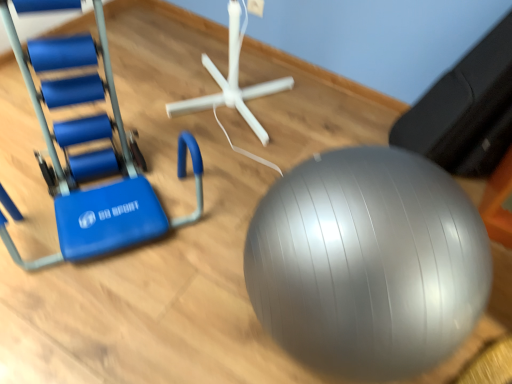
Describe the element at coordinates (102, 186) in the screenshot. The image size is (512, 384). I see `blue rubber swivel chair at left` at that location.

Measure the distance between blue rubber swivel chair at left and camera.

blue rubber swivel chair at left and camera are 3.43 feet apart from each other.

Identify the location of blue rubber swivel chair at left. (102, 186).

Where is `silver rubber ball at center`? silver rubber ball at center is located at coordinates (368, 263).

The height and width of the screenshot is (384, 512). Describe the element at coordinates (368, 263) in the screenshot. I see `silver rubber ball at center` at that location.

The image size is (512, 384). Find the location of `blue rubber swivel chair at left`. blue rubber swivel chair at left is located at coordinates (102, 186).

Which object is positioned more to the right, silver rubber ball at center or blue rubber swivel chair at left?

From the viewer's perspective, silver rubber ball at center appears more on the right side.

Relative to blue rubber swivel chair at left, is silver rubber ball at center in front or behind?

silver rubber ball at center is positioned closer to the viewer than blue rubber swivel chair at left.

Is point (300, 291) more distant than point (91, 226)?

No, it is not.

From the image's perspective, relative to blue rubber swivel chair at left, is silver rubber ball at center above or below?

From the image's perspective, silver rubber ball at center appears below blue rubber swivel chair at left.

From a real-world perspective, is silver rubber ball at center physically located above or below blue rubber swivel chair at left?

silver rubber ball at center is situated lower than blue rubber swivel chair at left in the real world.

Considering the sizes of objects silver rubber ball at center and blue rubber swivel chair at left in the image provided, who is thinner, silver rubber ball at center or blue rubber swivel chair at left?

With smaller width is blue rubber swivel chair at left.

From the picture: Can you confirm if silver rubber ball at center is shorter than blue rubber swivel chair at left?

Yes, silver rubber ball at center is shorter than blue rubber swivel chair at left.

Which of these two, silver rubber ball at center or blue rubber swivel chair at left, is bigger?

Bigger between the two is blue rubber swivel chair at left.

Is silver rubber ball at center situated inside blue rubber swivel chair at left or outside?

silver rubber ball at center lies outside blue rubber swivel chair at left.

Are silver rubber ball at center and blue rubber swivel chair at left beside each other?

No, silver rubber ball at center is not in contact with blue rubber swivel chair at left.

Is silver rubber ball at center facing towards blue rubber swivel chair at left?

No.

Can you tell me how much silver rubber ball at center and blue rubber swivel chair at left differ in facing direction?

silver rubber ball at center and blue rubber swivel chair at left are facing 85.7 degrees away from each other.

Measure the distance between silver rubber ball at center and blue rubber swivel chair at left.

silver rubber ball at center and blue rubber swivel chair at left are 26.09 inches apart from each other.

The image size is (512, 384). I want to click on ball located in front of the blue rubber swivel chair at left, so click(368, 263).

Would you say blue rubber swivel chair at left is to the left or to the right of silver rubber ball at center in the picture?

Based on their positions, blue rubber swivel chair at left is located to the left of silver rubber ball at center.

In the image, is blue rubber swivel chair at left positioned in front of or behind silver rubber ball at center?

Clearly, blue rubber swivel chair at left is behind silver rubber ball at center.

Considering the positions of point (48, 178) and point (455, 208), is point (48, 178) closer or farther from the camera than point (455, 208)?

Point (48, 178) is farther from the camera than point (455, 208).

From the image's perspective, is blue rubber swivel chair at left on silver rubber ball at center?

Indeed, from the image's perspective, blue rubber swivel chair at left is shown above silver rubber ball at center.

From a real-world perspective, is blue rubber swivel chair at left positioned under silver rubber ball at center based on gravity?

No, from a real-world perspective, blue rubber swivel chair at left is not beneath silver rubber ball at center.

Considering the relative sizes of blue rubber swivel chair at left and silver rubber ball at center in the image provided, is blue rubber swivel chair at left wider than silver rubber ball at center?

In fact, blue rubber swivel chair at left might be narrower than silver rubber ball at center.

Which of these two, blue rubber swivel chair at left or silver rubber ball at center, stands shorter?

With less height is silver rubber ball at center.

Looking at this image, which of these two, blue rubber swivel chair at left or silver rubber ball at center, is smaller?

silver rubber ball at center.

Could silver rubber ball at center be considered to be inside blue rubber swivel chair at left?

Definitely not — silver rubber ball at center is not inside blue rubber swivel chair at left.

Is blue rubber swivel chair at left far from silver rubber ball at center?

blue rubber swivel chair at left is actually quite close to silver rubber ball at center.

Is blue rubber swivel chair at left oriented towards silver rubber ball at center?

No, blue rubber swivel chair at left is not oriented towards silver rubber ball at center.

Looking at this image, can you tell me how much blue rubber swivel chair at left and silver rubber ball at center differ in facing direction?

85.7 degrees separate the facing orientations of blue rubber swivel chair at left and silver rubber ball at center.

How distant is blue rubber swivel chair at left from silver rubber ball at center?

blue rubber swivel chair at left is 26.09 inches from silver rubber ball at center.

Find the location of `swivel chair above the silver rubber ball at center (from the image's perspective)`. swivel chair above the silver rubber ball at center (from the image's perspective) is located at coordinates (102, 186).

There is a silver rubber ball at center. Find the location of `swivel chair above it (from a real-world perspective)`. swivel chair above it (from a real-world perspective) is located at coordinates (102, 186).

I want to click on swivel chair lying above the silver rubber ball at center (from the image's perspective), so click(102, 186).